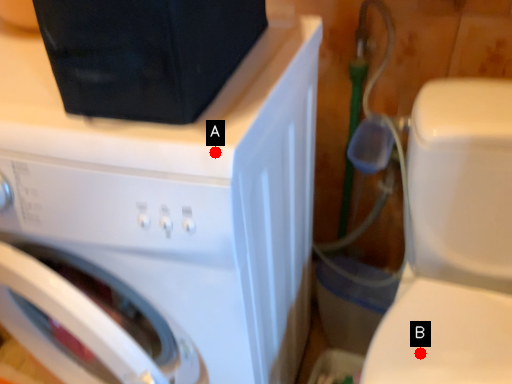
Question: Two points are circled on the image, labeled by A and B beside each circle. Which point is farther to the camera?

Choices:
 (A) A is further
 (B) B is further

Answer: (B)